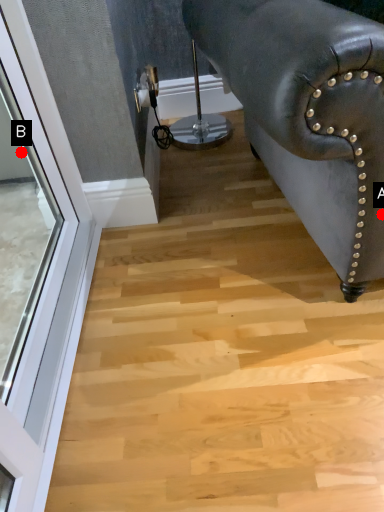
Question: Two points are circled on the image, labeled by A and B beside each circle. Among these points, which one is farthest from the camera?

Choices:
 (A) A is further
 (B) B is further

Answer: (B)